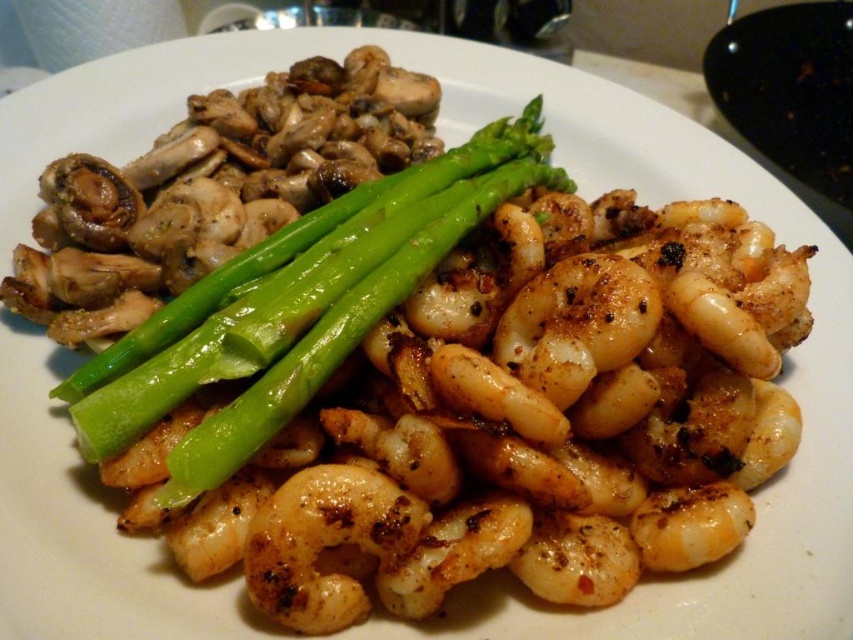
You are a food critic observing this meal. You notice the green glossy asparagus at center and the glossy white shrimp at center. Which of these two items is placed higher on the plate?

The green glossy asparagus at center is located above the glossy white shrimp at center, so it is placed higher on the plate.